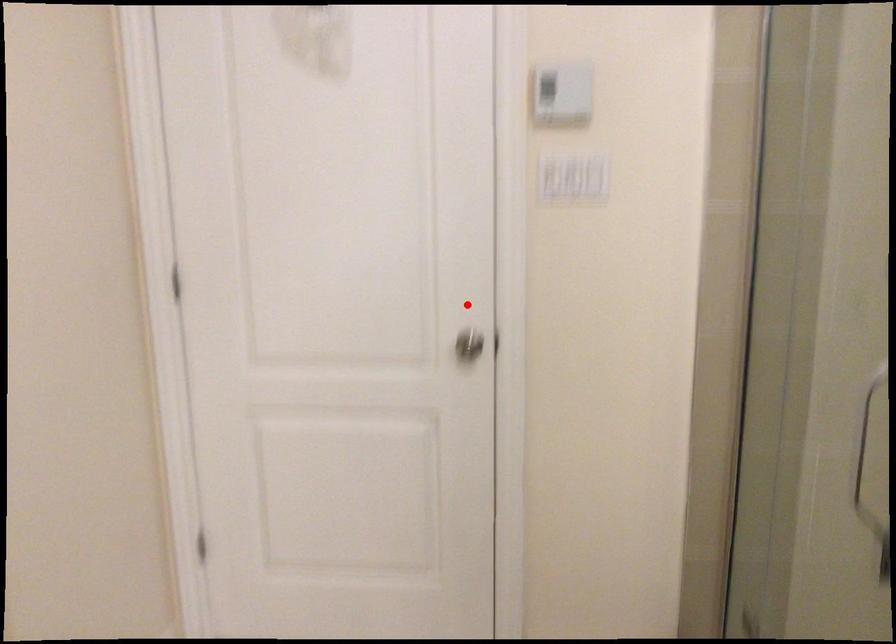
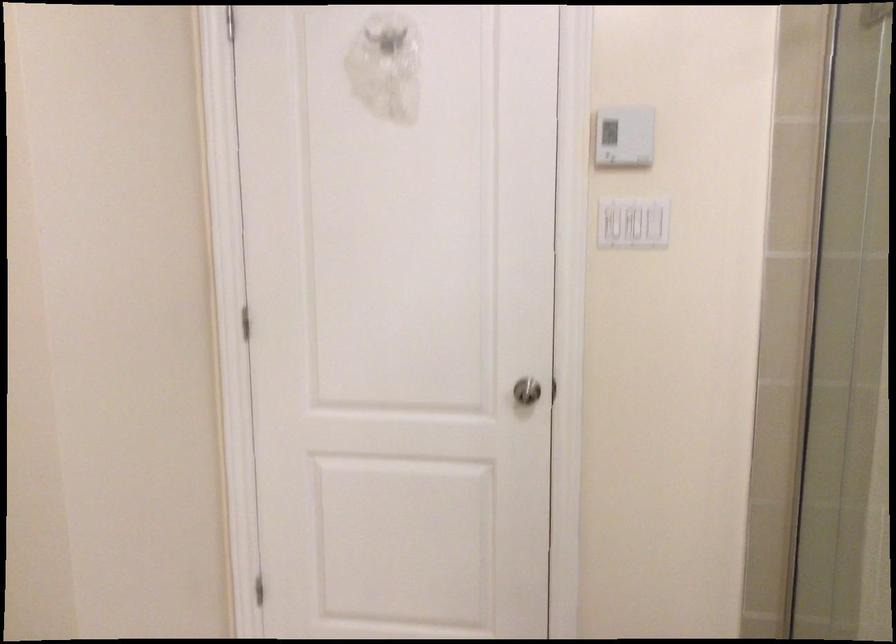
The point at the highlighted location is marked in the first image. Where is the corresponding point in the second image?

(526, 391)